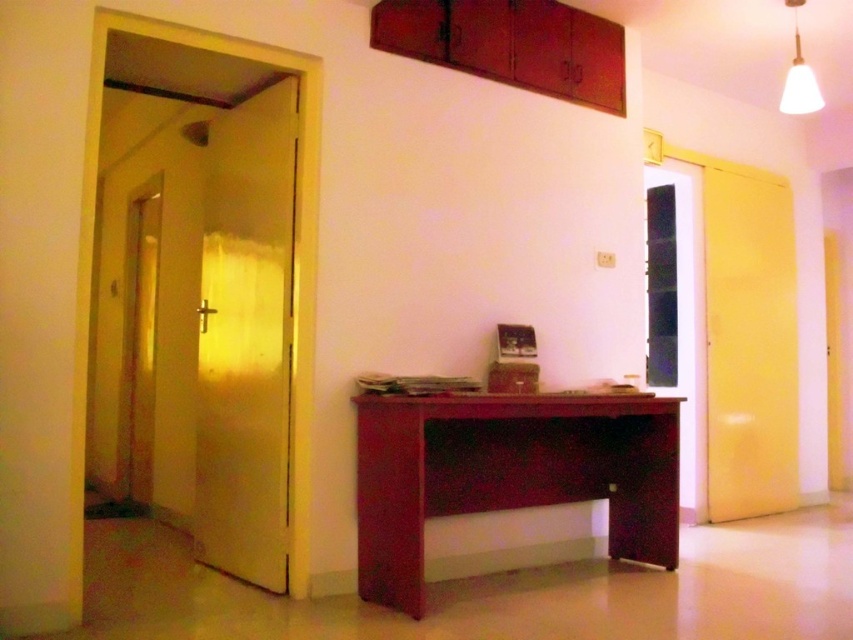
You are moving a large painting that is 1.2 meters wide. You want to hang it on the wall between the matte wood cabinet at upper center and the white matte lampshade at upper right. Can the space between them accommodate the painting?

The matte wood cabinet at upper center is wider than the white matte lampshade at upper right, so the space between them may be sufficient to hang the painting. However, without knowing the exact distance between the two objects, it is impossible to confirm if the 1.2 meter painting will fit.

In the scene shown: You are standing in the hallway and need to place a new plant pot between the satin wood desk at center and the white matte lampshade at upper right. Based on their positions, which side of the desk should you place the plant pot to ensure it is between them?

The satin wood desk at center is to the left of the white matte lampshade at upper right, so placing the plant pot to the right side of the desk would position it between them.

You are standing in the hallway and want to place a new desk in the center of the room. The existing desk is located at point (508, 472). Is there enough space to place the new desk next to the existing one?

The existing desk is located at point (508, 472), but the scene description does not provide information about the size of the desk or the available space in the room. Therefore, it is unclear if there is enough space to place another desk next to it.